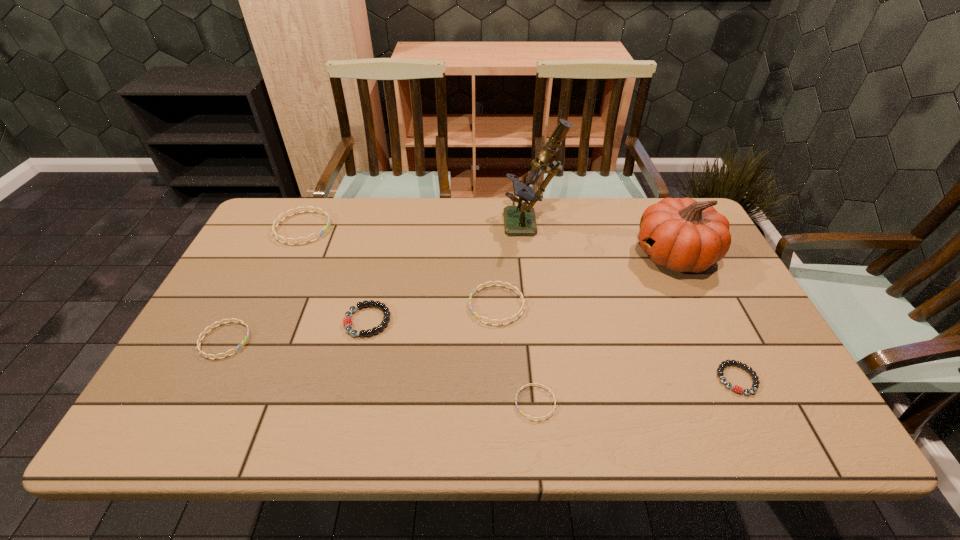
Identify the location of free space that satisfies the following two spatial constraints: 1. at the eyepiece of the rightmost bracelet; 2. on the left side of the microscope. This screenshot has height=540, width=960. (552, 379).

This screenshot has width=960, height=540. What are the coordinates of `vacant space that satisfies the following two spatial constraints: 1. at the eyepiece of the brown microscope; 2. on the front side of the third bracelet from left to right` in the screenshot? It's located at (544, 321).

This screenshot has height=540, width=960. I want to click on vacant space that satisfies the following two spatial constraints: 1. on the back side of the smaller black bracelet; 2. on the surface of the third smallest blue bracelet showing star-shaped elements, so click(701, 305).

You are a GUI agent. You are given a task and a screenshot of the screen. Output one action in this format:
    pyautogui.click(x=<x>, y=<y>)
    Task: Click on the blank area in the image that satisfies the following two spatial constraints: 1. on the surface of the second biggest blue bracelet showing star-shaped elements; 2. on the front side of the left black bracelet
    The width and height of the screenshot is (960, 540).
    Given the screenshot: What is the action you would take?
    pyautogui.click(x=497, y=321)